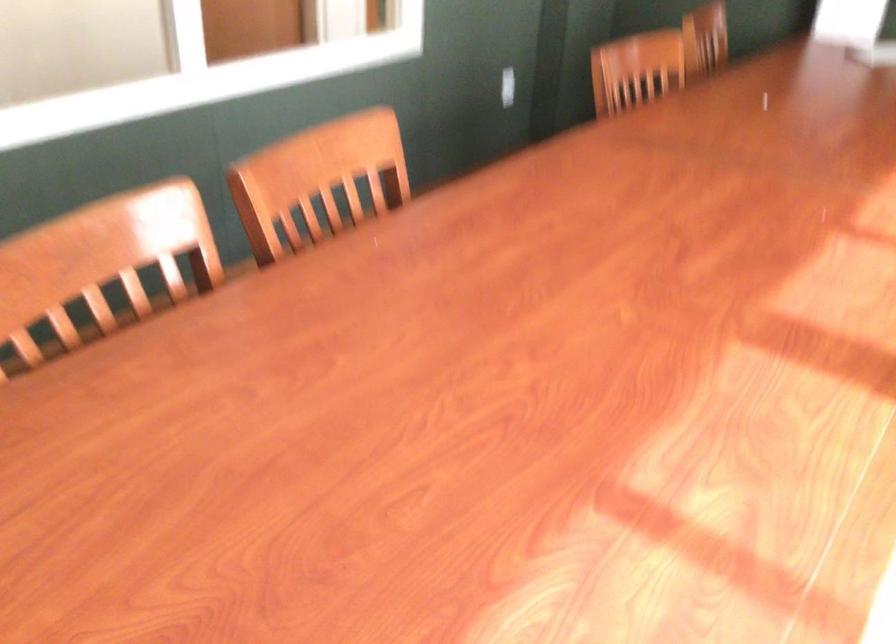
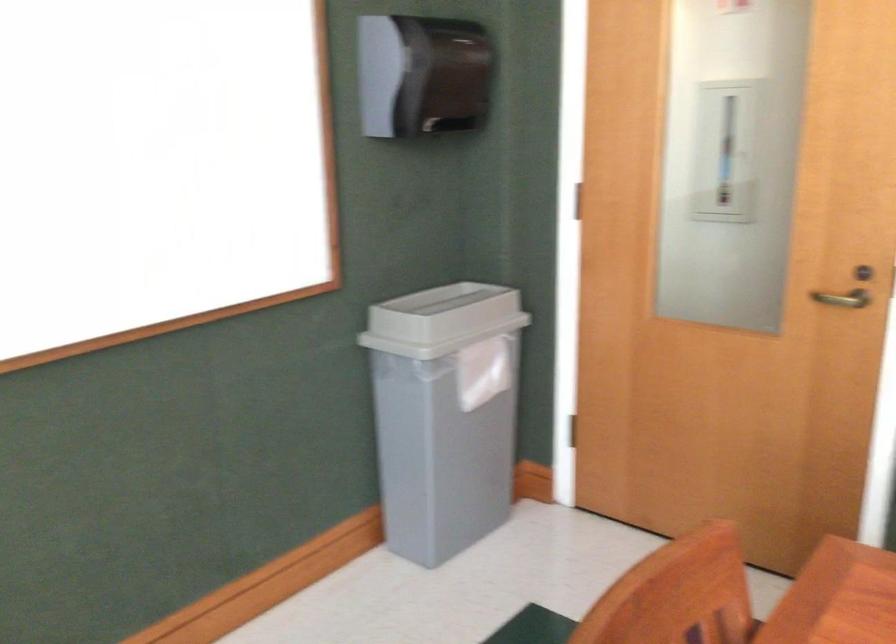
Question: The camera is either moving clockwise (left) or counter-clockwise (right) around the object. The first image is from the beginning of the video and the second image is from the end. Is the camera moving left or right when shooting the video?

Choices:
 (A) Left
 (B) Right

Answer: (B)